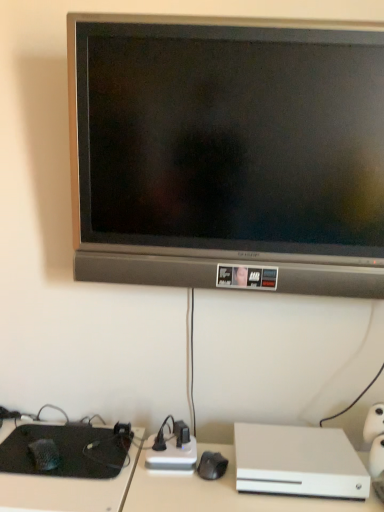
Question: From a real-world perspective, is white matte xbox one at lower right physically above black matte keyboard at lower left?

Choices:
 (A) yes
 (B) no

Answer: (A)

Question: From the image's perspective, would you say white matte xbox one at lower right is shown under black matte keyboard at lower left?

Choices:
 (A) yes
 (B) no

Answer: (B)

Question: Is white matte xbox one at lower right directly adjacent to black matte keyboard at lower left?

Choices:
 (A) yes
 (B) no

Answer: (B)

Question: Considering the relative sizes of white matte xbox one at lower right and black matte keyboard at lower left in the image provided, is white matte xbox one at lower right bigger than black matte keyboard at lower left?

Choices:
 (A) yes
 (B) no

Answer: (A)

Question: Is white matte xbox one at lower right positioned behind black matte keyboard at lower left?

Choices:
 (A) no
 (B) yes

Answer: (A)

Question: Are white matte xbox one at lower right and black matte keyboard at lower left far apart?

Choices:
 (A) no
 (B) yes

Answer: (A)

Question: Is matte black tv at upper center positioned before black matte keyboard at lower left?

Choices:
 (A) yes
 (B) no

Answer: (A)

Question: Is matte black tv at upper center outside black matte keyboard at lower left?

Choices:
 (A) yes
 (B) no

Answer: (A)

Question: From the image's perspective, would you say matte black tv at upper center is shown under black matte keyboard at lower left?

Choices:
 (A) yes
 (B) no

Answer: (B)

Question: From the image's perspective, is matte black tv at upper center over black matte keyboard at lower left?

Choices:
 (A) yes
 (B) no

Answer: (A)

Question: Does matte black tv at upper center have a smaller size compared to black matte keyboard at lower left?

Choices:
 (A) yes
 (B) no

Answer: (B)

Question: Is matte black tv at upper center at the left side of black matte keyboard at lower left?

Choices:
 (A) no
 (B) yes

Answer: (A)

Question: From a real-world perspective, is white matte xbox one at lower right physically above matte black tv at upper center?

Choices:
 (A) no
 (B) yes

Answer: (A)